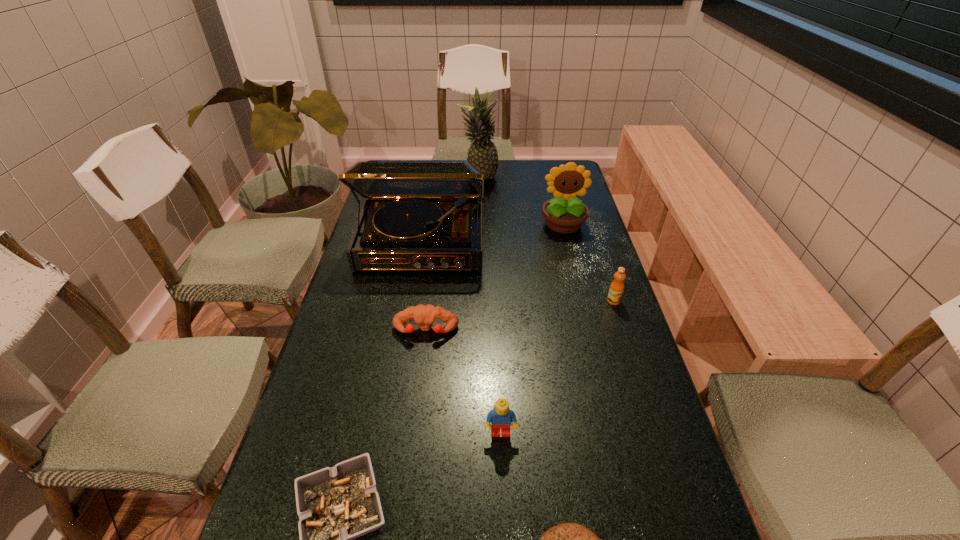
Identify the location of vacant area located 0.320m on the front label of the fourth farthest object. (648, 406).

You are a GUI agent. You are given a task and a screenshot of the screen. Output one action in this format:
    pyautogui.click(x=<x>, y=<y>)
    Task: Click on the vacant space positioned 0.050m on the face of the Lego
    This screenshot has height=540, width=960.
    Given the screenshot: What is the action you would take?
    pyautogui.click(x=502, y=463)

You are a GUI agent. You are given a task and a screenshot of the screen. Output one action in this format:
    pyautogui.click(x=<x>, y=<y>)
    Task: Click on the vacant space located with the gloves of the sixth tallest object facing forward
    This screenshot has width=960, height=540.
    Given the screenshot: What is the action you would take?
    pyautogui.click(x=411, y=454)

The width and height of the screenshot is (960, 540). Identify the location of object at the far edge. (482, 155).

In order to click on object that is at the left edge in this screenshot , I will do `click(418, 215)`.

Where is `sunflower that is at the right edge`? sunflower that is at the right edge is located at coordinates (564, 214).

Locate an element on the screen. The height and width of the screenshot is (540, 960). orange juice that is positioned at the right edge is located at coordinates (616, 289).

The width and height of the screenshot is (960, 540). Find the location of `vacant region at the far edge of the desktop`. vacant region at the far edge of the desktop is located at coordinates (499, 164).

The image size is (960, 540). I want to click on vacant area at the left edge of the desktop, so click(x=355, y=315).

Identify the location of vacant space at the right edge of the desktop. Image resolution: width=960 pixels, height=540 pixels. point(587,336).